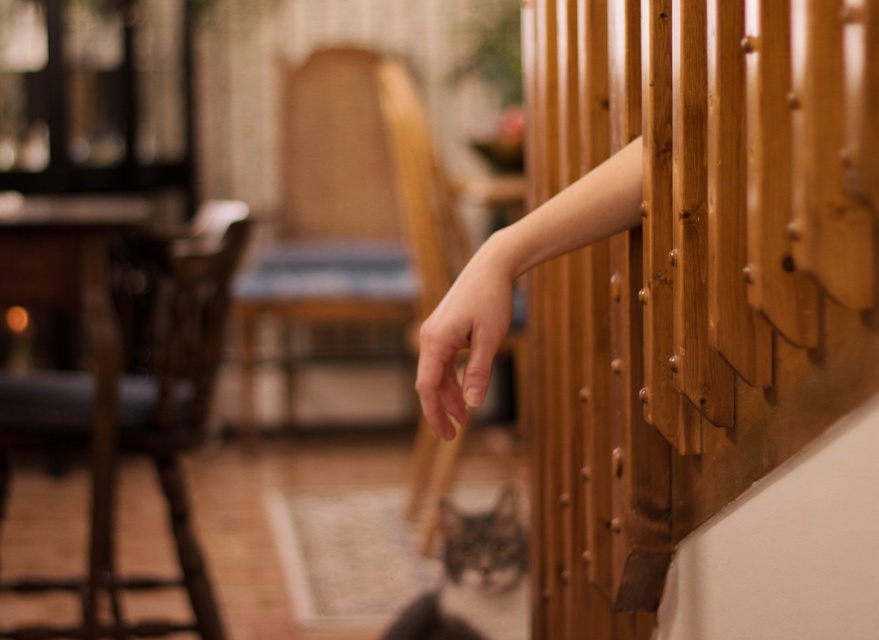
Based on the scene description, what is the 2D coordinate of the wooden chair at left?

The wooden chair at left is located at the 2D coordinate point of (117, 388).

You are a small toy mouse that is 15 cm long. You want to hide between the wooden at right and the gray fur cat at lower center. Can you fit in that space?

The wooden at right is narrower than the gray fur cat at lower center, so the space between them might be sufficient for the toy mouse. However, since the exact width of the space isn t provided, it s uncertain. The wooden at right has a width less than the cat, but without knowing the cat s width or the distance between them, we can t confirm if 15 cm would fit.

Consider the image. You are a photographer trying to capture a closeup shot of the wooden railing and the hand in the scene. You notice two points marked in the image. Which of the two points, point (91, 342) or point (505, 280), is closer to your camera lens?

Point (91, 342) is further to the camera than point (505, 280), so the point closer to the camera lens is point (91, 342).